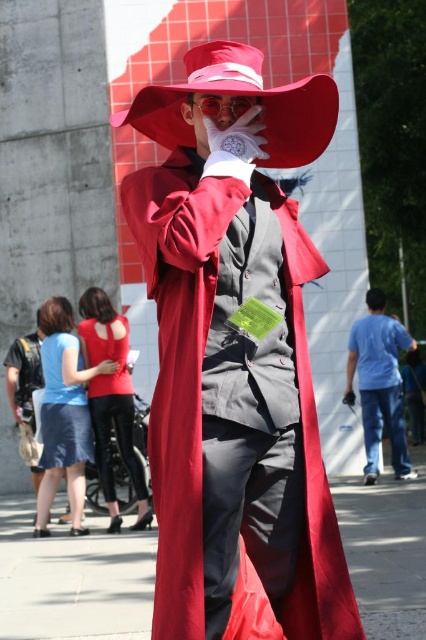
You are a photographer trying to capture a clear shot of both the blue cotton shirt at right and the shiny red goggles at center. Since you want both items to be in focus, which one should you adjust your camera focus on first?

You should focus on the shiny red goggles at center first because the blue cotton shirt at right is closer to you than the shiny red goggles at center, so adjusting focus starting from the closer object ensures both can be in focus.